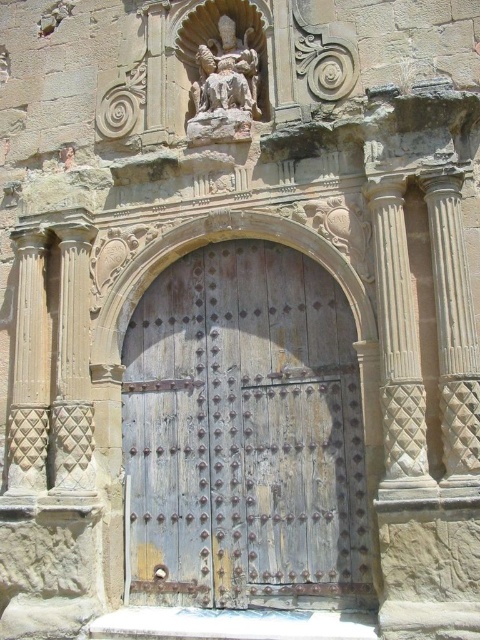
Question: Which object is farther from the camera taking this photo?

Choices:
 (A) carved stone statue at upper center
 (B) polished stone column at left
 (C) white textured column at right

Answer: (A)

Question: Does polished stone column at left appear over carved stone statue at upper center?

Choices:
 (A) no
 (B) yes

Answer: (A)

Question: Based on their relative distances, which object is nearer to the carved stone column at left?

Choices:
 (A) smooth stone column at right
 (B) weathered wood door at center

Answer: (B)

Question: Does weathered wood door at center lie behind carved stone statue at upper center?

Choices:
 (A) yes
 (B) no

Answer: (B)

Question: Which object is positioned closest to the smooth stone column at right?

Choices:
 (A) white textured column at right
 (B) carved stone statue at upper center
 (C) polished stone column at left
 (D) carved stone column at left

Answer: (A)

Question: Does white textured column at right appear under carved stone column at left?

Choices:
 (A) yes
 (B) no

Answer: (B)